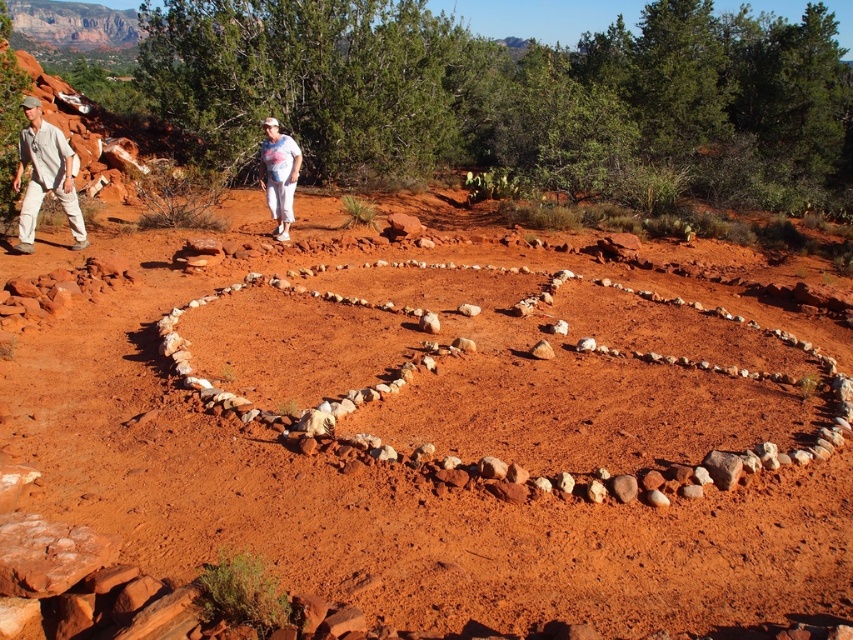
Is reddish-brown soil at center thinner than light beige pants at left?

No, reddish-brown soil at center is not thinner than light beige pants at left.

The height and width of the screenshot is (640, 853). In order to click on reddish-brown soil at center in this screenshot , I will do 440,428.

You are a GUI agent. You are given a task and a screenshot of the screen. Output one action in this format:
    pyautogui.click(x=<x>, y=<y>)
    Task: Click on the reddish-brown soil at center
    
    Given the screenshot: What is the action you would take?
    coord(440,428)

From the picture: Can you confirm if reddish-brown soil at center is taller than white tie-dye shirt at center?

Yes, reddish-brown soil at center is taller than white tie-dye shirt at center.

Does reddish-brown soil at center have a greater width compared to white tie-dye shirt at center?

Correct, the width of reddish-brown soil at center exceeds that of white tie-dye shirt at center.

You are a GUI agent. You are given a task and a screenshot of the screen. Output one action in this format:
    pyautogui.click(x=<x>, y=<y>)
    Task: Click on the reddish-brown soil at center
    The width and height of the screenshot is (853, 640).
    Given the screenshot: What is the action you would take?
    pyautogui.click(x=440, y=428)

Is matte khaki pants at left smaller than white tie-dye shirt at center?

Actually, matte khaki pants at left might be larger than white tie-dye shirt at center.

Does matte khaki pants at left have a greater height compared to white tie-dye shirt at center?

Yes.

Which is behind, point (24, 227) or point (280, 186)?

Point (280, 186)

In order to click on matte khaki pants at left in this screenshot , I will do `click(45, 176)`.